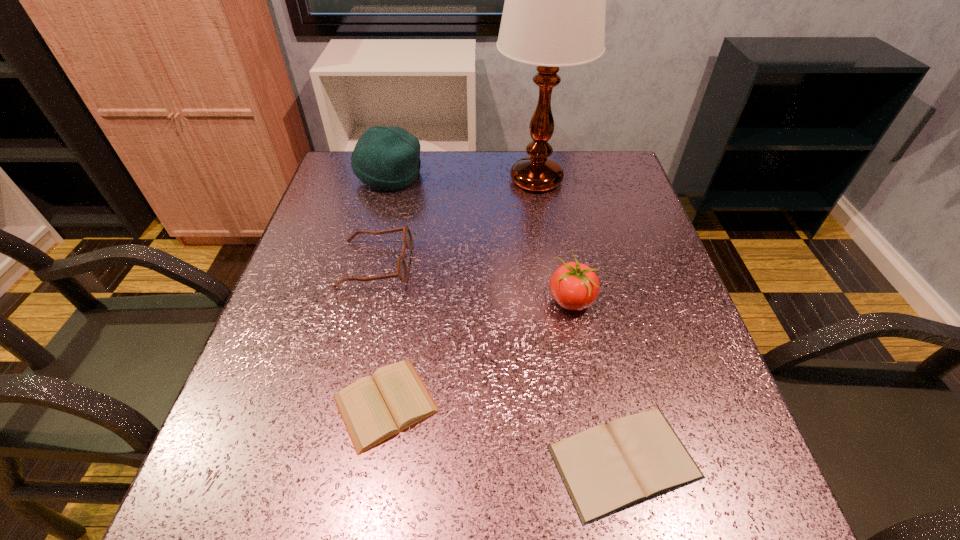
This screenshot has width=960, height=540. In order to click on vacant space located on the right of the diary in this screenshot , I will do `click(574, 404)`.

I want to click on vacant space situated on the back of the Bible, so click(587, 294).

You are a GUI agent. You are given a task and a screenshot of the screen. Output one action in this format:
    pyautogui.click(x=<x>, y=<y>)
    Task: Click on the table lamp that is at the far edge
    Image resolution: width=960 pixels, height=540 pixels.
    Given the screenshot: What is the action you would take?
    pyautogui.click(x=554, y=12)

Locate an element on the screen. The height and width of the screenshot is (540, 960). beanie present at the far edge is located at coordinates (388, 158).

Find the location of a particular element. The width and height of the screenshot is (960, 540). object that is at the near edge is located at coordinates (606, 469).

Locate an element on the screen. The height and width of the screenshot is (540, 960). beanie present at the left edge is located at coordinates (388, 158).

What are the coordinates of `spectacles that is positioned at the left edge` in the screenshot? It's located at (402, 270).

Identify the location of table lamp that is positioned at the right edge. The width and height of the screenshot is (960, 540). (554, 12).

This screenshot has height=540, width=960. Identify the location of Bible positioned at the right edge. [x=606, y=469].

You are a GUI agent. You are given a task and a screenshot of the screen. Output one action in this format:
    pyautogui.click(x=<x>, y=<y>)
    Task: Click on the object present at the far left corner
    This screenshot has height=540, width=960.
    Given the screenshot: What is the action you would take?
    pyautogui.click(x=388, y=158)